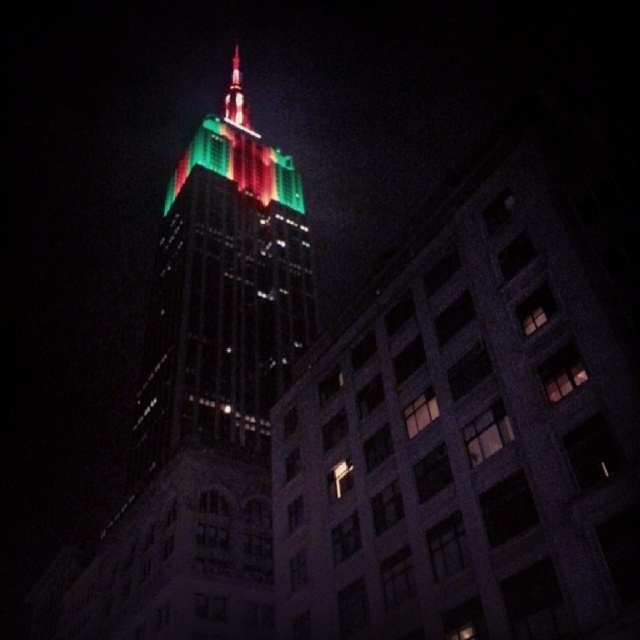
Question: Does green glass skyscraper at center appear over shiny glass spire at upper center?

Choices:
 (A) yes
 (B) no

Answer: (B)

Question: Is green glass skyscraper at center closer to camera compared to shiny glass spire at upper center?

Choices:
 (A) no
 (B) yes

Answer: (B)

Question: Is green glass skyscraper at center thinner than shiny glass spire at upper center?

Choices:
 (A) no
 (B) yes

Answer: (B)

Question: Which of the following is the closest to the observer?

Choices:
 (A) (236, 324)
 (B) (228, 122)

Answer: (A)

Question: Which point is farther from the camera taking this photo?

Choices:
 (A) (236, 68)
 (B) (225, 413)

Answer: (A)